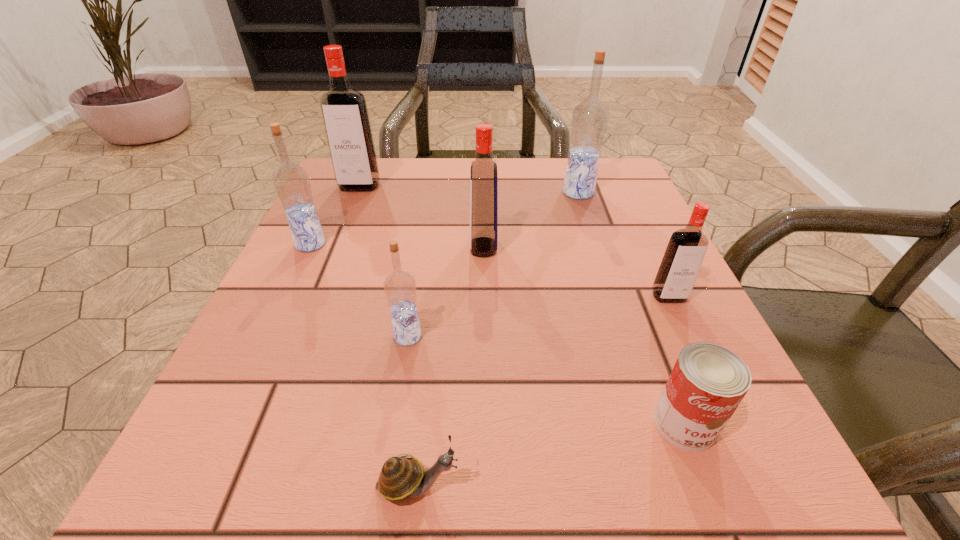
Where is `the biggest blue vodka`? This screenshot has height=540, width=960. the biggest blue vodka is located at coordinates (589, 120).

Identify the location of the farthest blue vodka. The width and height of the screenshot is (960, 540). (589, 120).

Where is `the leftmost red vodka`? This screenshot has width=960, height=540. the leftmost red vodka is located at coordinates (344, 109).

At what (x,y) coordinates should I click in order to perform the action: click on the biggest red vodka. Please return your answer as a coordinate pair (x, y). The image size is (960, 540). Looking at the image, I should click on (344, 109).

The width and height of the screenshot is (960, 540). Find the location of `the third vodka from right to left`. the third vodka from right to left is located at coordinates (483, 179).

Find the location of a particular element. the fifth object from left to right is located at coordinates (483, 179).

Find the location of a particular element. The image size is (960, 540). the second smallest blue vodka is located at coordinates (291, 182).

Image resolution: width=960 pixels, height=540 pixels. Find the location of `the leftmost blue vodka`. the leftmost blue vodka is located at coordinates (291, 182).

At what (x,y) coordinates should I click in order to perform the action: click on the rightmost red vodka. Please return your answer as a coordinate pair (x, y). This screenshot has width=960, height=540. Looking at the image, I should click on (682, 260).

At what (x,y) coordinates should I click in order to perform the action: click on the smallest red vodka. Please return your answer as a coordinate pair (x, y). The height and width of the screenshot is (540, 960). Looking at the image, I should click on click(682, 260).